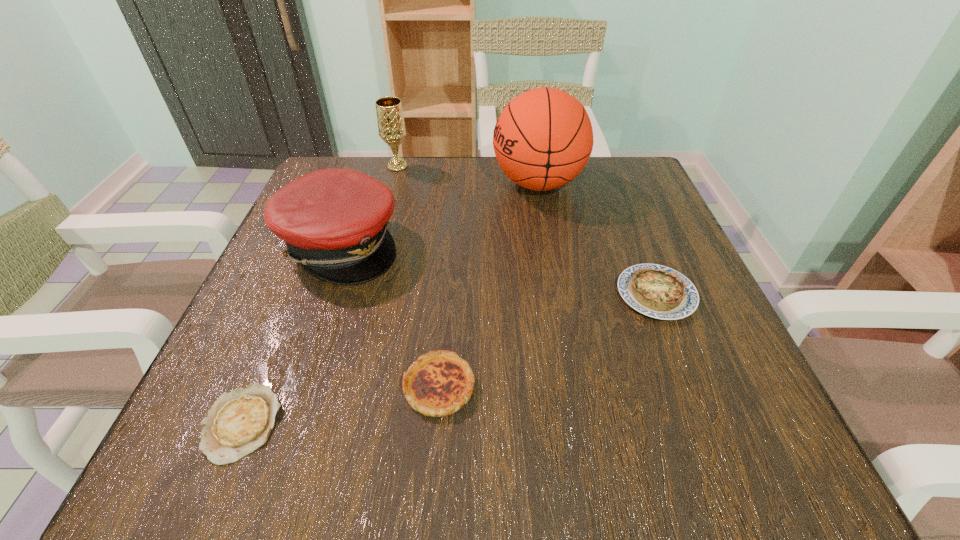
Identify the location of the tallest object. tap(542, 140).

The height and width of the screenshot is (540, 960). Find the location of `chalice`. chalice is located at coordinates (391, 126).

Find the location of `the third tallest object`. the third tallest object is located at coordinates (334, 221).

The width and height of the screenshot is (960, 540). In order to click on the rightmost quiche in this screenshot , I will do `click(657, 291)`.

Locate an element on the screen. The height and width of the screenshot is (540, 960). the second quiche from left to right is located at coordinates (439, 383).

The width and height of the screenshot is (960, 540). I want to click on the shortest quiche, so click(x=239, y=422).

This screenshot has width=960, height=540. I want to click on the leftmost quiche, so click(x=239, y=422).

Find the location of a particular element. This screenshot has height=540, width=960. vacant space situated on the side with logo of the basketball is located at coordinates (372, 184).

The width and height of the screenshot is (960, 540). What are the coordinates of `vacant space situated on the side with logo of the basketball` in the screenshot? It's located at (415, 184).

Image resolution: width=960 pixels, height=540 pixels. I want to click on vacant region located on the side with logo of the basketball, so click(x=453, y=184).